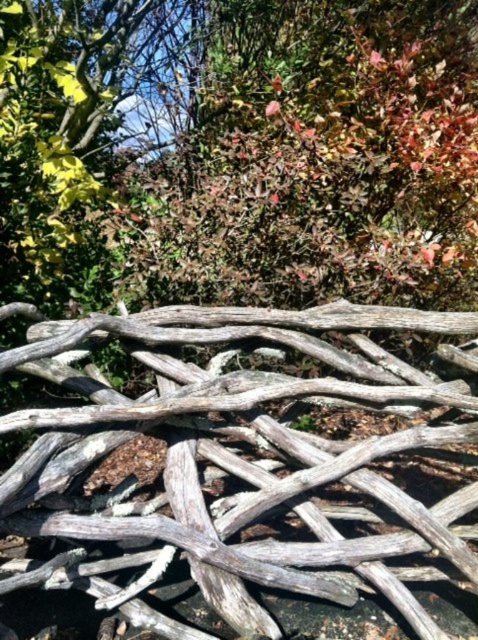
Question: Among these points, which one is farthest from the camera?

Choices:
 (A) (417, 625)
 (B) (334, 244)

Answer: (B)

Question: Which point is farther to the camera?

Choices:
 (A) weathered wood at bottom
 (B) green matte leaves at upper center

Answer: (B)

Question: Which point is farther to the camera?

Choices:
 (A) (318, 492)
 (B) (388, 262)

Answer: (B)

Question: In this image, where is weathered wood at bottom located relative to green matte leaves at upper center?

Choices:
 (A) below
 (B) above

Answer: (A)

Question: Does weathered wood at bottom lie in front of green matte leaves at upper center?

Choices:
 (A) yes
 (B) no

Answer: (A)

Question: Does weathered wood at bottom have a larger size compared to green matte leaves at upper center?

Choices:
 (A) yes
 (B) no

Answer: (B)